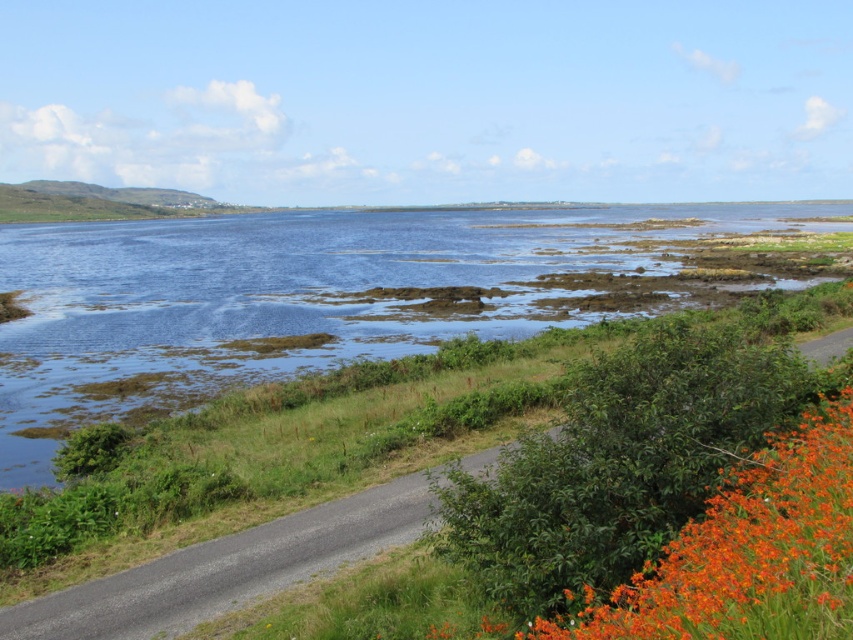
Looking at this image, you are standing on the paved road in the foreground and want to take a photo of the blue water at center and the orange matte flowers at lower right. Which object will appear closer to the camera in your photo?

The blue water at center will appear closer to the camera in your photo because the orange matte flowers at lower right is behind it.

You are standing at the bottom left of the image and want to reach the point marked as point (314, 296). According to the scene description, what type of terrain will you encounter along the way?

The point (314, 296) is on blue water at center, so you will encounter blue water at center along the way.

You are a photographer standing on the paved road in the foreground. You want to capture a photo that includes both the blue water at center and the orange matte flowers at lower right. Based on their positions, which object should you frame first in your camera viewfinder to ensure both are in the shot?

The blue water at center is positioned over orange matte flowers at lower right, so you should frame the blue water at center first as it is closer to the photographer and covers the area above the orange matte flowers at lower right, ensuring both are included in the shot.